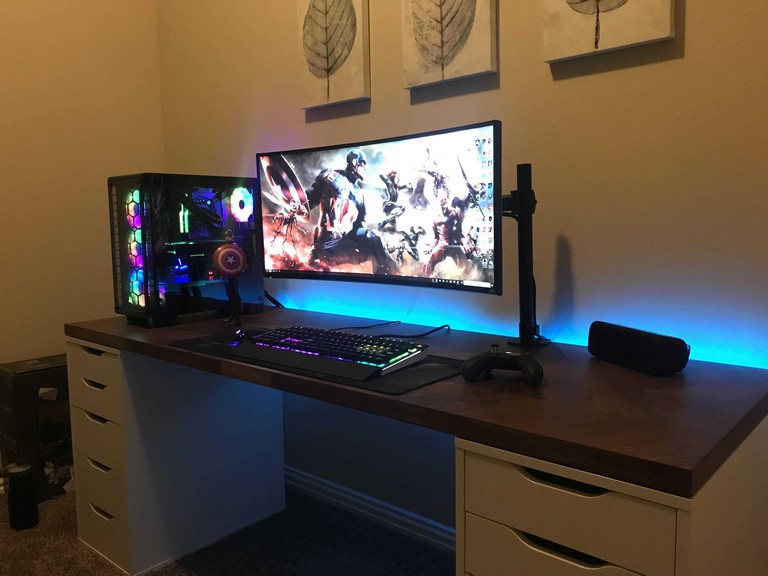
Find where a chair should be in front of the desk in the image. Your answer should be formatted as a list of tuples, i.e. [(x1, y1), (x2, y2), ...], where each tuple contains the x and y coordinates of a point satisfying the conditions above.

[(226, 476)]